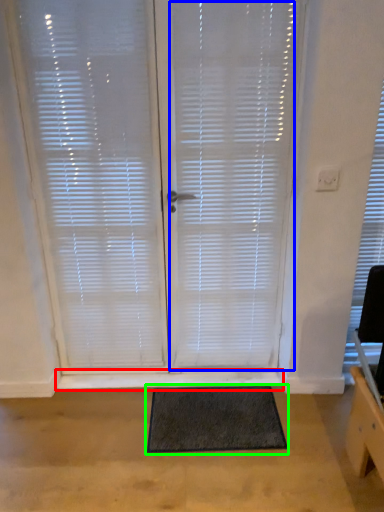
Question: Which object is positioned closest to window sill (highlighted by a red box)? Select from blind (highlighted by a blue box) and doormat (highlighted by a green box).

Choices:
 (A) blind
 (B) doormat

Answer: (B)